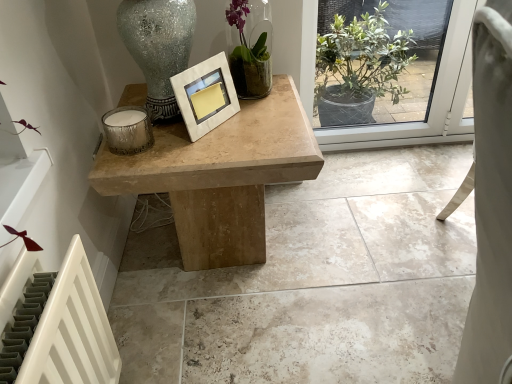
Where is `vacant area that lies to the right of natural wood table at center`? The width and height of the screenshot is (512, 384). vacant area that lies to the right of natural wood table at center is located at coordinates [x=364, y=236].